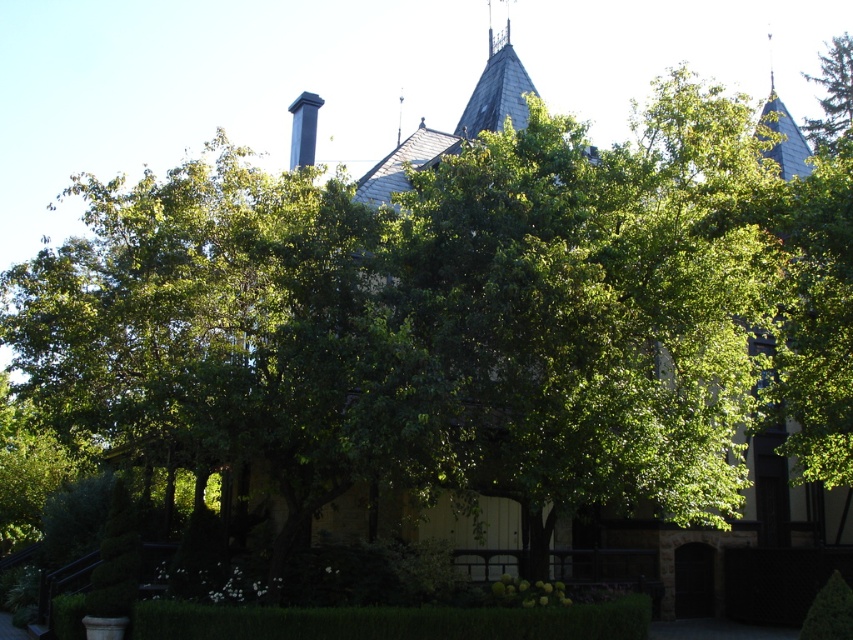
You are a landscape architect designing a new garden layout. You need to ensure that the dark gray slate chimney at upper center and the green leafy tree at upper right are both visible from the main pathway. Given their sizes, which object might require strategic placement to ensure visibility?

The dark gray slate chimney at upper center has a smaller size compared to green leafy tree at upper right, so it might require strategic placement to ensure visibility as it is smaller and could be overshadowed by the larger tree.

You are standing in the garden looking towards the building. Which object, the dark gray slate chimney at upper center or the green leafy tree at upper right, is closer to you?

The dark gray slate chimney at upper center is closer to you because it is positioned over the green leafy tree at upper right, indicating it is in front of the tree.